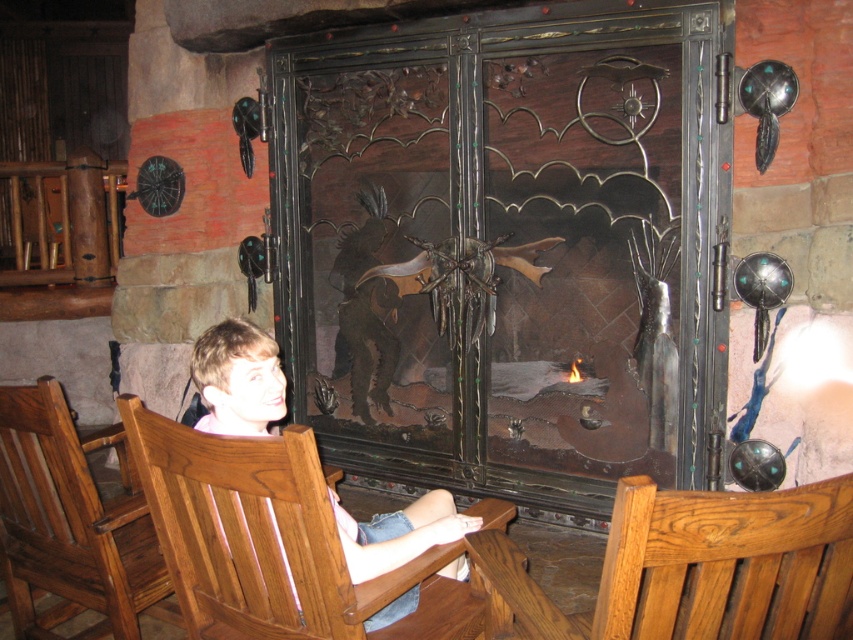
Does dark wrought iron fireplace at center come in front of light brown wood chair at center?

That is False.

Between point (383, 76) and point (462, 566), which one is positioned in front?

Positioned in front is point (462, 566).

Locate an element on the screen. dark wrought iron fireplace at center is located at coordinates (505, 248).

Does brown wood chair at lower left have a smaller size compared to light brown wood chair at center?

Actually, brown wood chair at lower left might be larger than light brown wood chair at center.

Which is behind, point (151, 596) or point (206, 348)?

The point (151, 596) is more distant.

Identify the location of brown wood chair at lower left. The width and height of the screenshot is (853, 640). (71, 524).

Who is positioned more to the left, dark wrought iron fireplace at center or brown wood chair at lower left?

From the viewer's perspective, brown wood chair at lower left appears more on the left side.

Does dark wrought iron fireplace at center have a lesser width compared to brown wood chair at lower left?

No.

Find the location of a particular element. dark wrought iron fireplace at center is located at coordinates (505, 248).